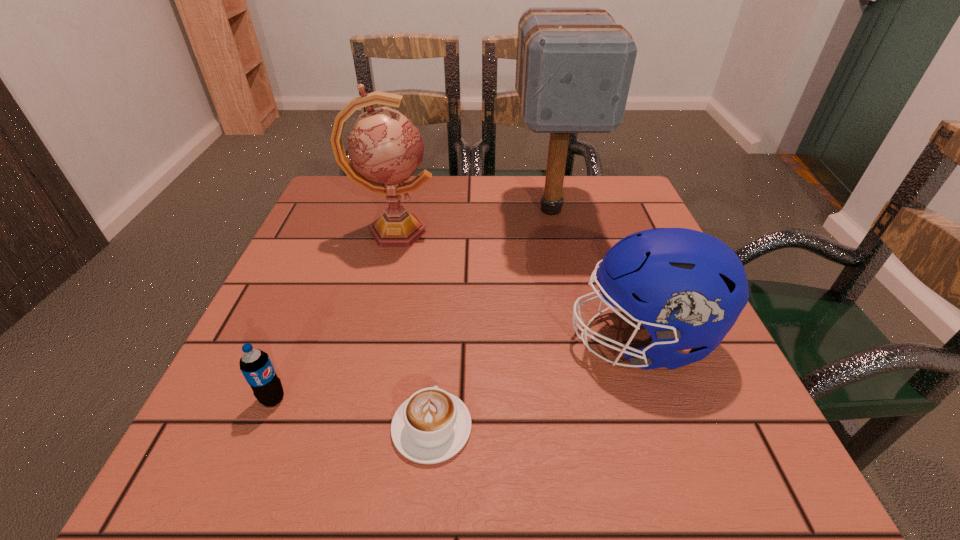
Identify the location of soda bottle that is at the left edge. (256, 366).

Identify the location of mallet at the right edge. (574, 66).

The image size is (960, 540). I want to click on football helmet that is at the right edge, so click(687, 288).

Where is `object at the far left corner`? Image resolution: width=960 pixels, height=540 pixels. object at the far left corner is located at coordinates (385, 148).

You are a GUI agent. You are given a task and a screenshot of the screen. Output one action in this format:
    pyautogui.click(x=<x>, y=<y>)
    Task: Click on the object at the far right corner
    The height and width of the screenshot is (540, 960).
    Given the screenshot: What is the action you would take?
    pyautogui.click(x=574, y=66)

At what (x,y) coordinates should I click in order to perform the action: click on vacant space at the far edge. Please return your answer as a coordinate pair (x, y). Looking at the image, I should click on (444, 217).

In the image, there is a desktop. Identify the location of vacant space at the near edge. (348, 438).

The image size is (960, 540). What are the coordinates of `free space at the left edge of the desktop` in the screenshot? It's located at (306, 335).

Identify the location of vacant region at the right edge of the desktop. (666, 383).

At what (x,y) coordinates should I click in order to perform the action: click on vacant area at the far left corner of the desktop. Please return your answer as a coordinate pair (x, y). Looking at the image, I should click on (342, 192).